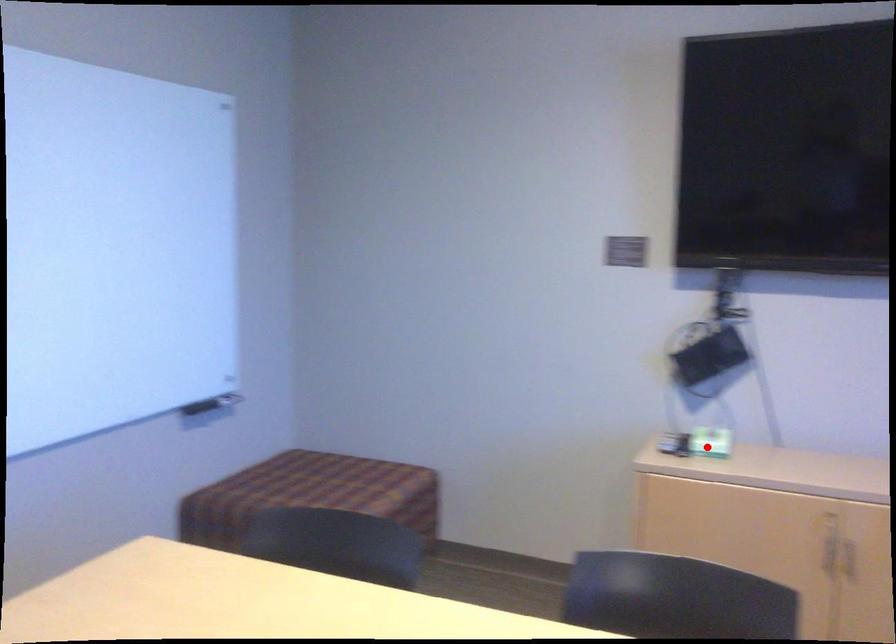
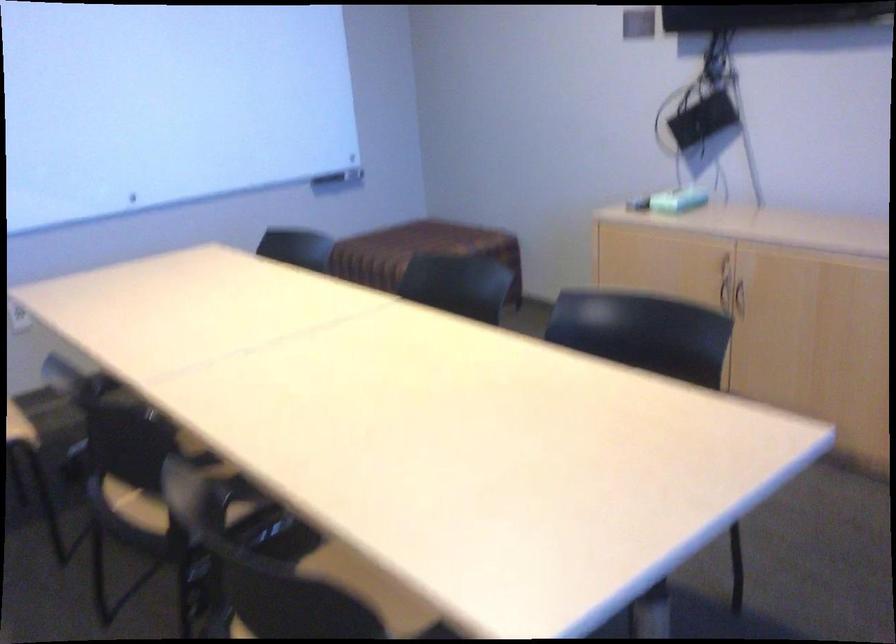
Question: I am providing you with two images of the same scene from different viewpoints. Given a red point in image1, look at the same physical point in image2. Is it:

Choices:
 (A) Closer to the viewpoint
 (B) Farther from the viewpoint

Answer: (B)